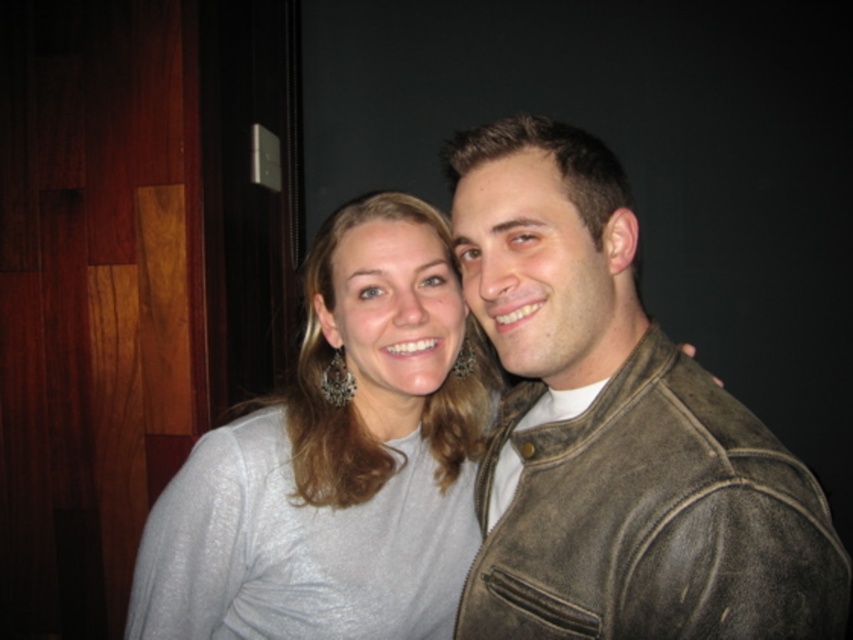
Question: Which object appears closest to the camera in this image?

Choices:
 (A) gray matte sweater at center
 (B) distressed leather jacket at right

Answer: (B)

Question: Among these objects, which one is farthest from the camera?

Choices:
 (A) gray matte sweater at center
 (B) distressed leather jacket at right

Answer: (A)

Question: Which point is closer to the camera?

Choices:
 (A) (320, 628)
 (B) (494, 129)

Answer: (B)

Question: From the image, what is the correct spatial relationship of distressed leather jacket at right in relation to gray matte sweater at center?

Choices:
 (A) right
 (B) left

Answer: (A)

Question: Can you confirm if distressed leather jacket at right is wider than gray matte sweater at center?

Choices:
 (A) yes
 (B) no

Answer: (B)

Question: Can you confirm if distressed leather jacket at right is positioned below gray matte sweater at center?

Choices:
 (A) yes
 (B) no

Answer: (B)